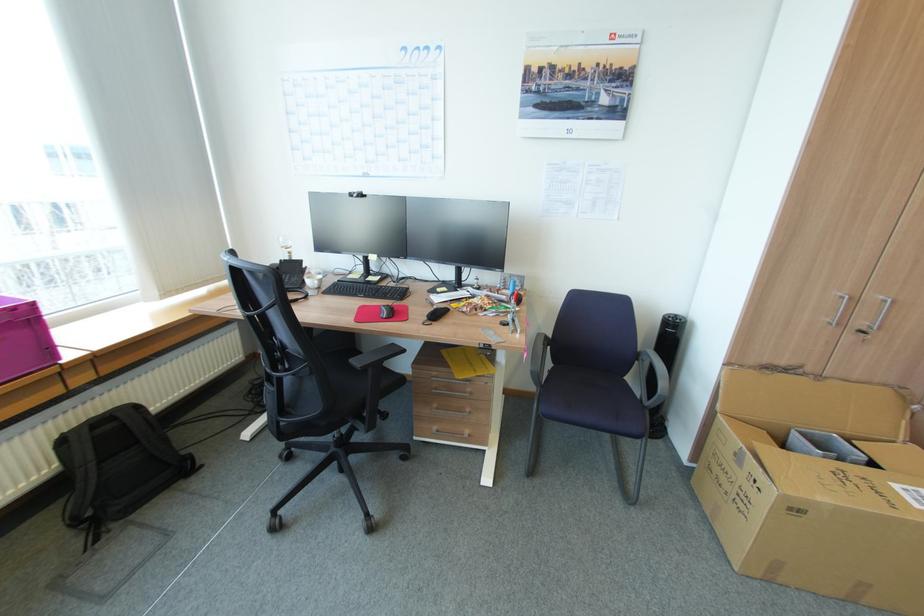
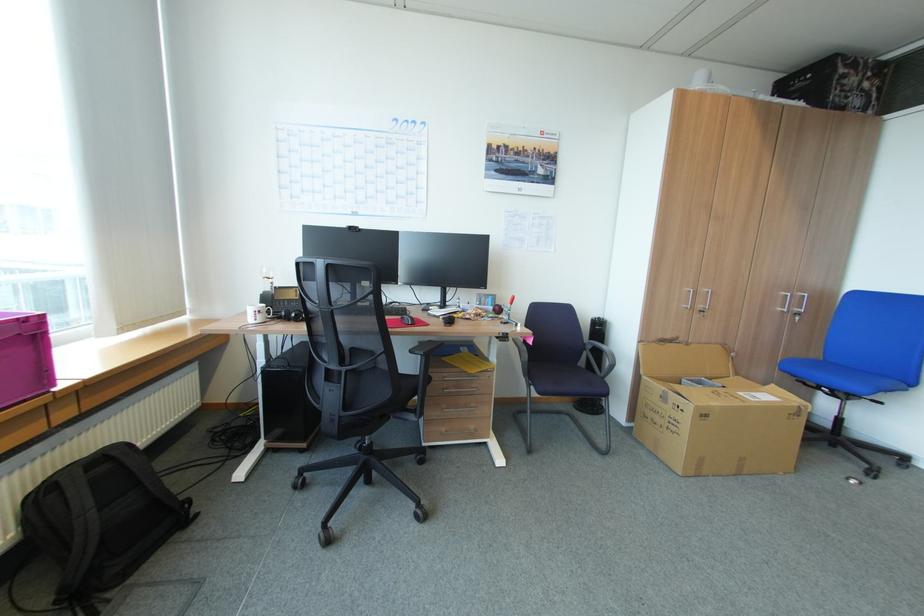
Where in the second image is the point corresponding to point (104, 463) from the first image?

(103, 511)